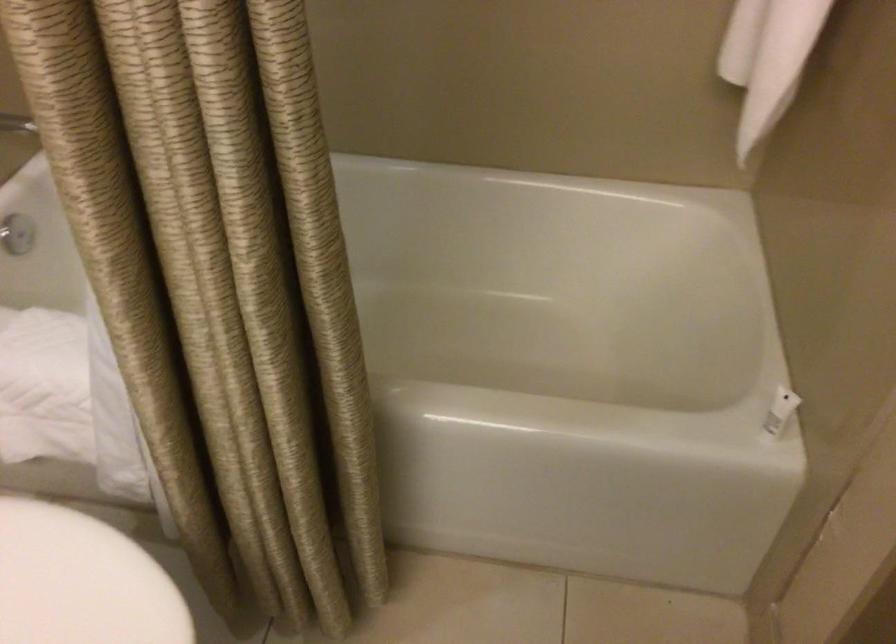
First-person continuous shooting, in which direction is the camera rotating?

The camera rotated toward right-down.